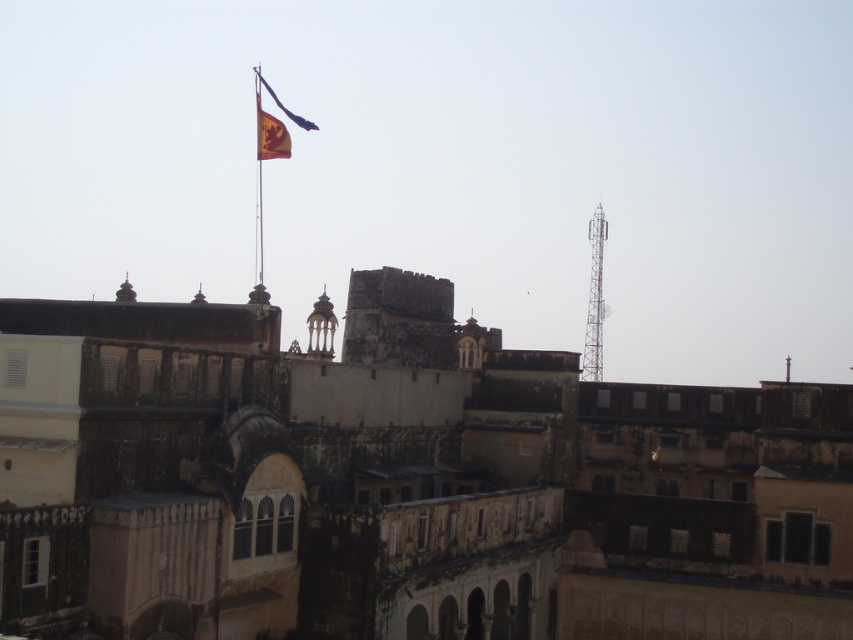
Does metallic flag pole at upper center lie behind yellow fabric flag at upper center?

No, metallic flag pole at upper center is in front of yellow fabric flag at upper center.

Does point (257, 275) come closer to viewer compared to point (288, 115)?

No, it is behind (288, 115).

The height and width of the screenshot is (640, 853). I want to click on metallic flag pole at upper center, so click(x=258, y=180).

Is metallic tower at right taller than yellow fabric flag at upper center?

Yes, metallic tower at right is taller than yellow fabric flag at upper center.

Can you confirm if metallic tower at right is wider than yellow fabric flag at upper center?

Yes, metallic tower at right is wider than yellow fabric flag at upper center.

Measure the distance between metallic tower at right and camera.

metallic tower at right and camera are 87.47 meters apart.

Find the location of a particular element. This screenshot has height=640, width=853. metallic tower at right is located at coordinates (595, 298).

Locate an element on the screen. metallic tower at right is located at coordinates (595, 298).

Does point (590, 316) lie behind point (257, 106)?

That is False.

Find the location of `metallic tower at right`. metallic tower at right is located at coordinates (595, 298).